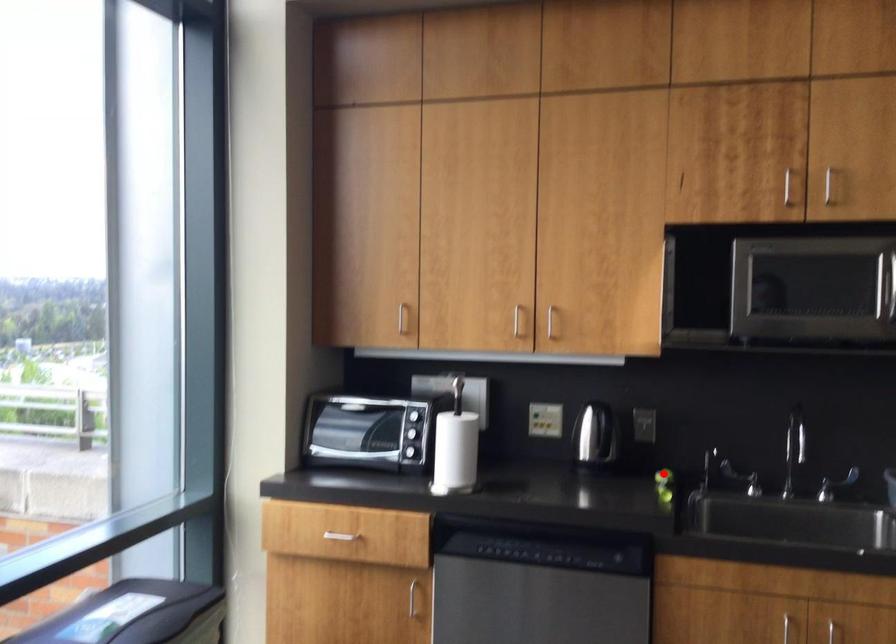
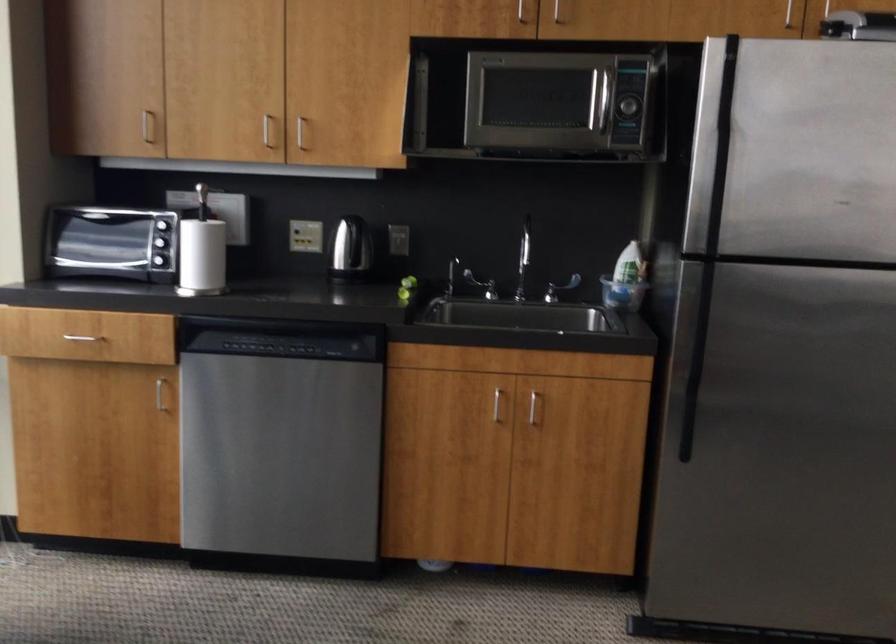
Locate, in the second image, the point that corresponds to the highlighted location in the first image.

(409, 281)